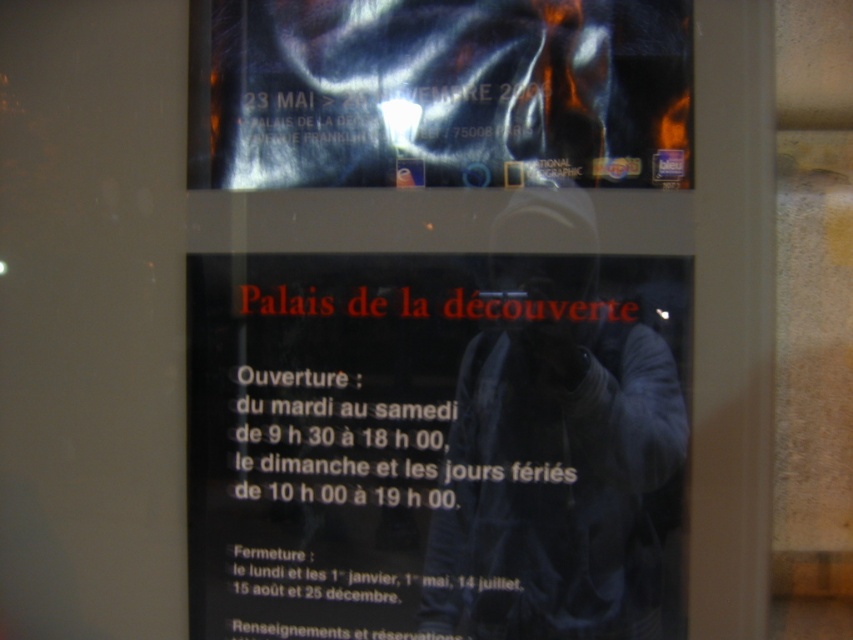
Question: Can you confirm if black paper at center is smaller than metallic reflective poster at upper center?

Choices:
 (A) no
 (B) yes

Answer: (A)

Question: Which object appears farthest from the camera in this image?

Choices:
 (A) black paper at center
 (B) metallic reflective poster at upper center

Answer: (A)

Question: Does black paper at center have a lesser width compared to metallic reflective poster at upper center?

Choices:
 (A) no
 (B) yes

Answer: (A)

Question: Where is black paper at center located in relation to metallic reflective poster at upper center in the image?

Choices:
 (A) above
 (B) below

Answer: (B)

Question: Which of the following is the closest to the observer?

Choices:
 (A) metallic reflective poster at upper center
 (B) black paper at center

Answer: (A)